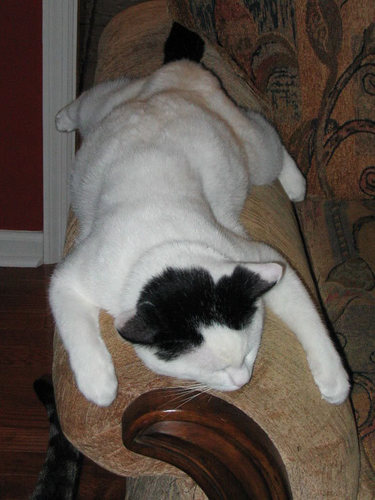
Where is `arm rest of sofa`? This screenshot has width=375, height=500. arm rest of sofa is located at coordinates (87, 434).